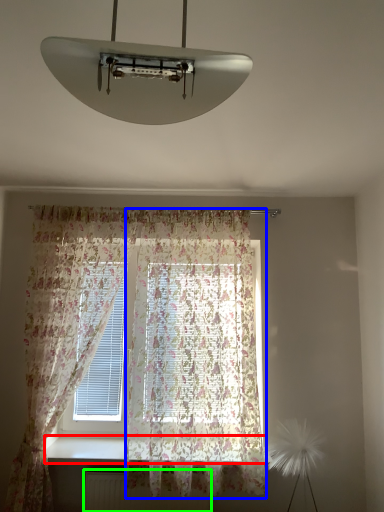
Question: Estimate the real-world distances between objects in this image. Which object is closer to window sill (highlighted by a red box), curtain (highlighted by a blue box) or radiator (highlighted by a green box)?

Choices:
 (A) curtain
 (B) radiator

Answer: (B)